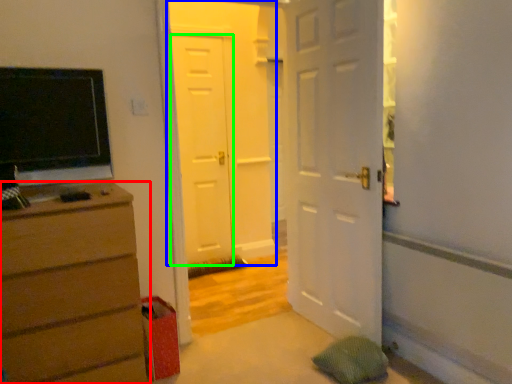
Question: Which object is positioned farthest from chest of drawers (highlighted by a red box)? Select from door (highlighted by a blue box) and door (highlighted by a green box).

Choices:
 (A) door
 (B) door

Answer: (A)